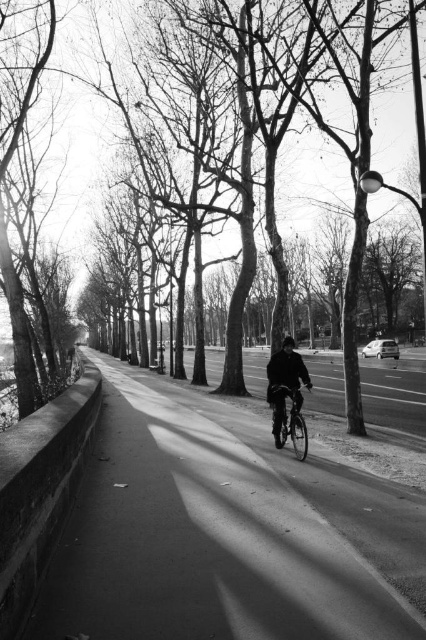
Question: Does dark matte bicycle at center have a smaller size compared to shiny metallic bicycle at center?

Choices:
 (A) no
 (B) yes

Answer: (A)

Question: Which object is farther from the camera taking this photo?

Choices:
 (A) shiny metallic bicycle at center
 (B) dark matte jacket at center
 (C) asphalt bike path at center

Answer: (B)

Question: Which is nearer to the dark matte jacket at center?

Choices:
 (A) asphalt bike path at center
 (B) shiny metallic bicycle at center
 (C) dark matte bicycle at center

Answer: (B)

Question: Does dark matte bicycle at center come in front of dark matte jacket at center?

Choices:
 (A) no
 (B) yes

Answer: (A)

Question: Which of the following is the closest to the observer?

Choices:
 (A) (290, 390)
 (B) (282, 429)
 (C) (203, 577)
 (D) (284, 211)

Answer: (C)

Question: Is asphalt bike path at center above dark matte jacket at center?

Choices:
 (A) yes
 (B) no

Answer: (B)